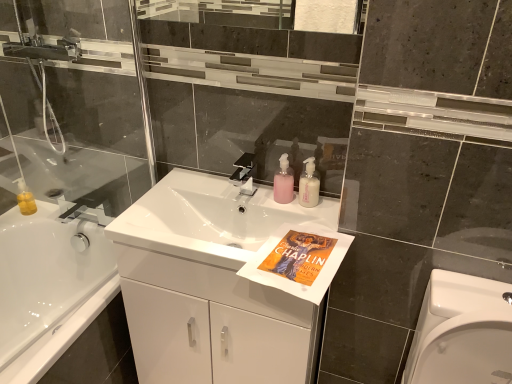
The image size is (512, 384). Find the location of `vacant space in front of pink translucent pump bottle at center, the 2th toiletry in the right-to-left sequence`. vacant space in front of pink translucent pump bottle at center, the 2th toiletry in the right-to-left sequence is located at coordinates (293, 228).